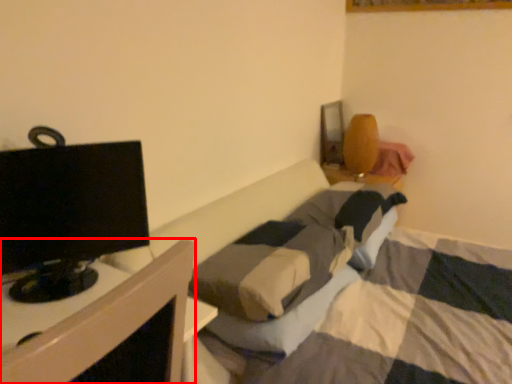
Question: Where is furniture (annotated by the red box) located in relation to television in the image?

Choices:
 (A) right
 (B) left

Answer: (A)